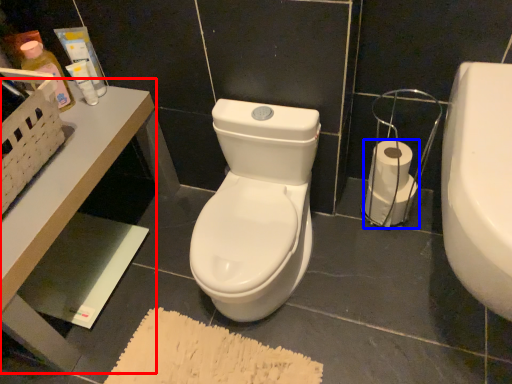
Question: Among these objects, which one is nearest to the camera, table (highlighted by a red box) or toilet paper (highlighted by a blue box)?

Choices:
 (A) table
 (B) toilet paper

Answer: (A)